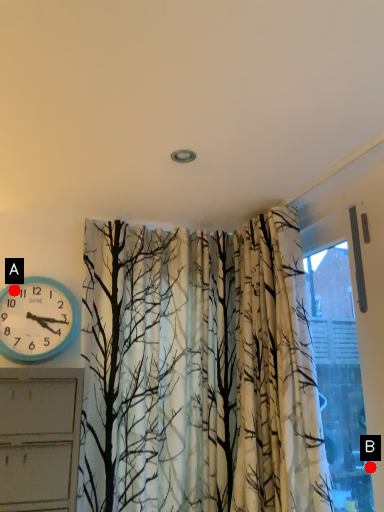
Question: Two points are circled on the image, labeled by A and B beside each circle. Which of the following is the farthest from the observer?

Choices:
 (A) A is further
 (B) B is further

Answer: (A)